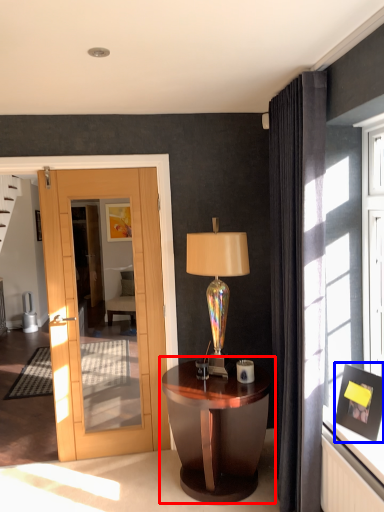
Question: Which object is closer to the camera taking this photo, nightstand (highlighted by a red box) or picture frame (highlighted by a blue box)?

Choices:
 (A) nightstand
 (B) picture frame

Answer: (B)